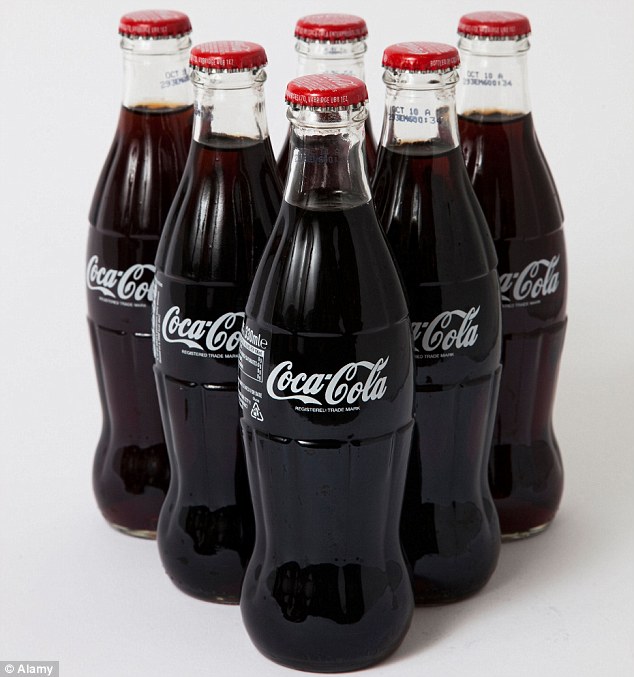
Identify the location of bottles. This screenshot has width=634, height=677. (320, 363), (224, 338), (110, 290), (429, 328), (531, 305), (335, 56).